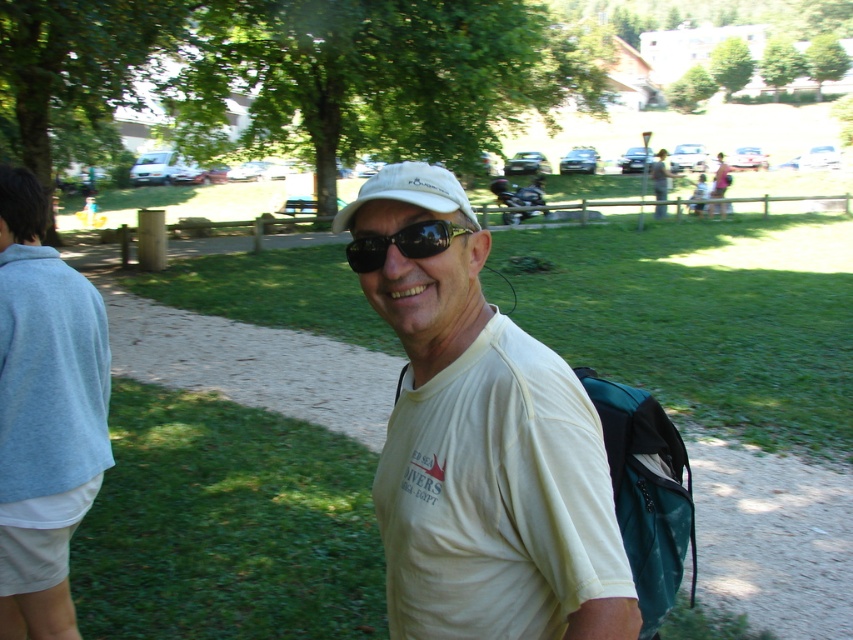
Does point (538, 358) come in front of point (657, 157)?

Yes.

Locate an element on the screen. This screenshot has width=853, height=640. white matte t-shirt at center is located at coordinates (479, 440).

Between gray cotton sweatshirt at left and matte white shirt at upper center, which one has less height?

With less height is gray cotton sweatshirt at left.

Can you confirm if gray cotton sweatshirt at left is positioned to the left of matte white shirt at upper center?

Indeed, gray cotton sweatshirt at left is positioned on the left side of matte white shirt at upper center.

The image size is (853, 640). I want to click on gray cotton sweatshirt at left, so click(x=44, y=403).

Identify the location of gray cotton sweatshirt at left. Image resolution: width=853 pixels, height=640 pixels. (44, 403).

Does teal fabric backpack at right have a larger size compared to matte white shirt at upper center?

No.

This screenshot has height=640, width=853. What do you see at coordinates (646, 492) in the screenshot?
I see `teal fabric backpack at right` at bounding box center [646, 492].

In order to click on teal fabric backpack at right in this screenshot , I will do `click(646, 492)`.